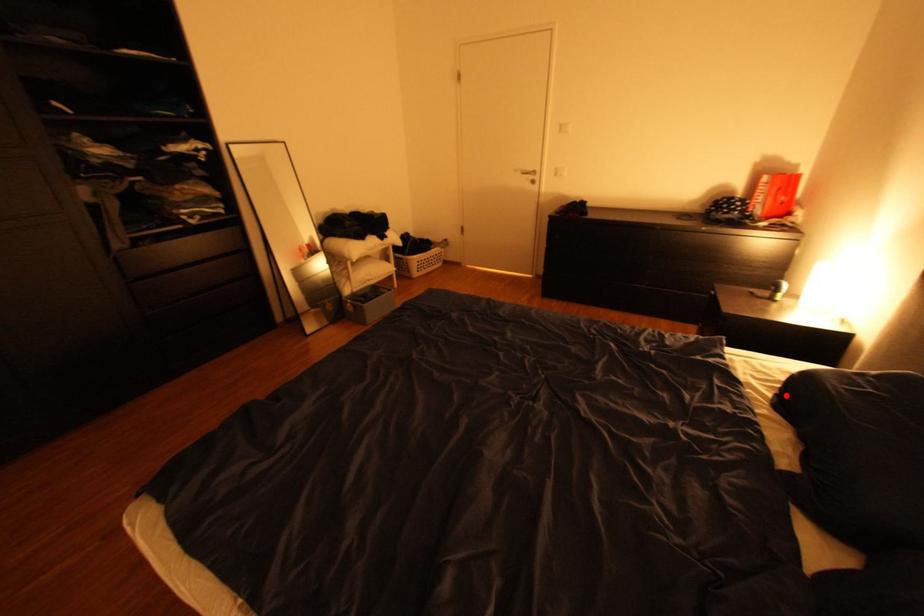
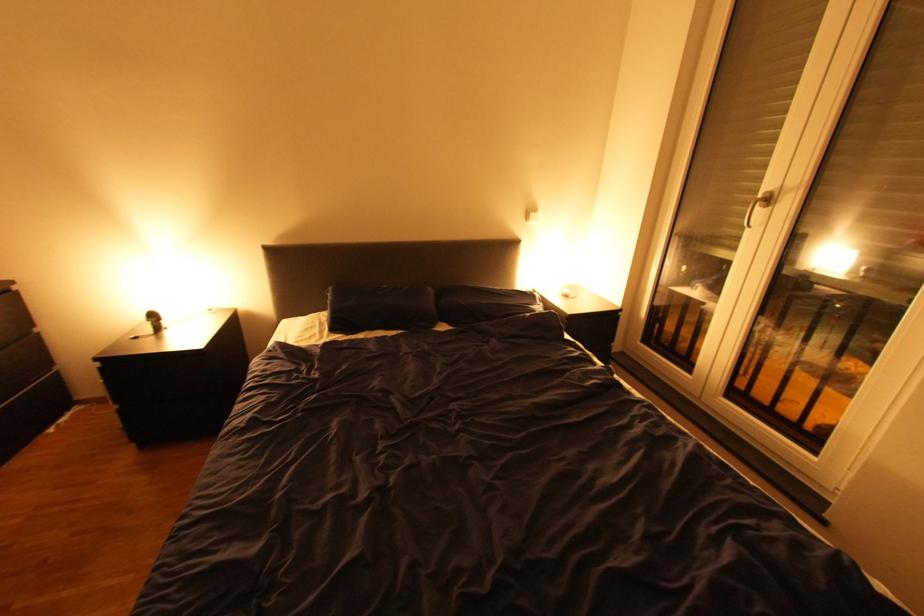
Locate, in the second image, the point that corresponds to the highlighted location in the first image.

(348, 333)